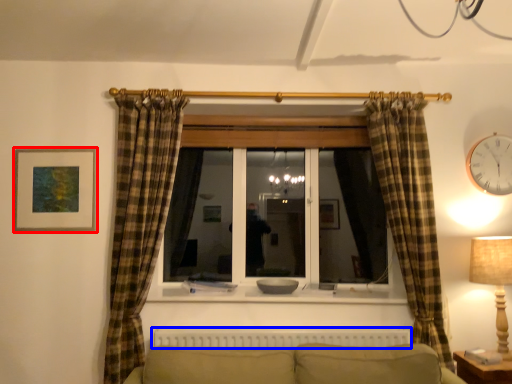
Question: Among these objects, which one is farthest to the camera, picture frame (highlighted by a red box) or radiator (highlighted by a blue box)?

Choices:
 (A) picture frame
 (B) radiator

Answer: (A)